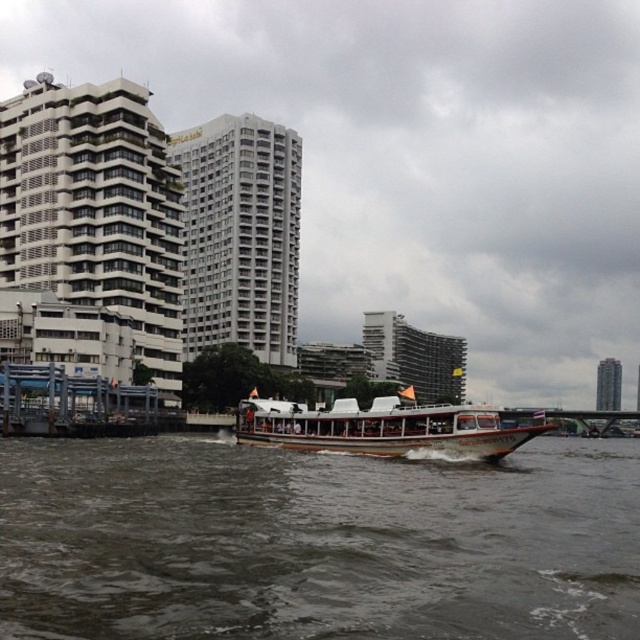
Is brown wooden boat at center bigger than wooden polished boat at center?

Actually, brown wooden boat at center might be smaller than wooden polished boat at center.

In the scene shown: Is brown wooden boat at center wider than wooden polished boat at center?

Yes, brown wooden boat at center is wider than wooden polished boat at center.

Where is `brown wooden boat at center`? brown wooden boat at center is located at coordinates (316, 541).

Identify the location of brown wooden boat at center. The width and height of the screenshot is (640, 640). (316, 541).